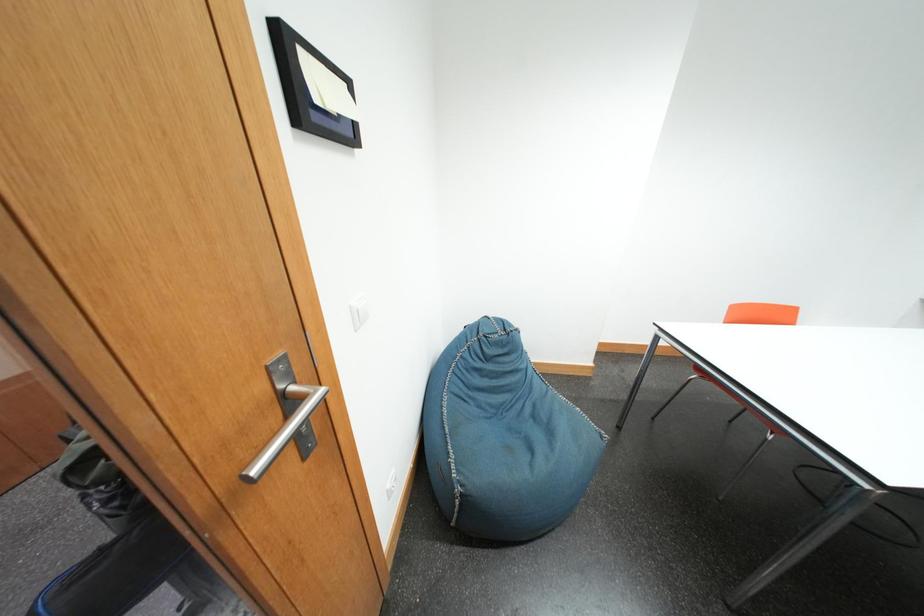
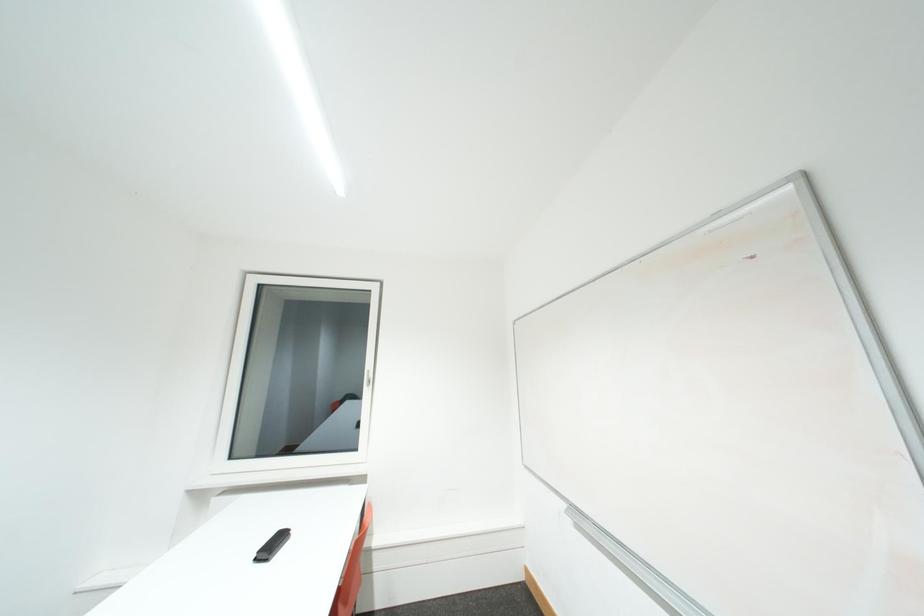
Question: How did the camera likely rotate?

Choices:
 (A) Left
 (B) Right
 (C) Up
 (D) Down

Answer: (B)